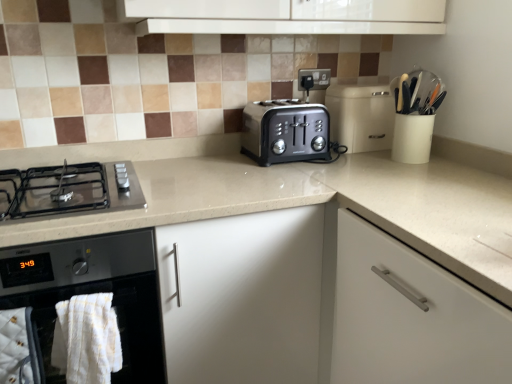
What do you see at coordinates (308, 202) in the screenshot? I see `beige glossy countertop at center` at bounding box center [308, 202].

What do you see at coordinates (285, 132) in the screenshot? This screenshot has height=384, width=512. I see `satin black toaster at center` at bounding box center [285, 132].

The image size is (512, 384). Describe the element at coordinates (361, 116) in the screenshot. I see `beige plastic bread bin at center` at that location.

Locate an element on the screen. This screenshot has height=384, width=512. black matte gas stove at lower left is located at coordinates (74, 190).

Identify the location of white fluffy bath towel at lower left. pyautogui.click(x=87, y=339).

Where is `black glass oven at lower left`? black glass oven at lower left is located at coordinates (92, 293).

From the picture: Which object is positioned more to the left, black glass oven at lower left or beige glossy countertop at center?

Positioned to the left is black glass oven at lower left.

Considering their positions, is black glass oven at lower left located in front of or behind beige glossy countertop at center?

In the image, black glass oven at lower left appears in front of beige glossy countertop at center.

Who is shorter, black glass oven at lower left or beige glossy countertop at center?

Standing shorter between the two is black glass oven at lower left.

Could you tell me if black glass oven at lower left is facing beige glossy countertop at center?

Yes, black glass oven at lower left is facing beige glossy countertop at center.

From a real-world perspective, who is located higher, beige glossy countertop at center or black glass oven at lower left?

black glass oven at lower left.

Between beige glossy countertop at center and black glass oven at lower left, which one is positioned behind?

Positioned behind is beige glossy countertop at center.

Can you confirm if beige glossy countertop at center is taller than black glass oven at lower left?

Yes, beige glossy countertop at center is taller than black glass oven at lower left.

Is beige glossy countertop at center positioned with its back to black glass oven at lower left?

Yes, beige glossy countertop at center is positioned with its back facing black glass oven at lower left.

Does point (251, 130) appear closer or farther from the camera than point (68, 352)?

Point (251, 130) is farther from the camera than point (68, 352).

Does satin black toaster at center lie behind white fluffy bath towel at lower left?

Yes, it is behind white fluffy bath towel at lower left.

Find the location of a particular element. bath towel to the left of satin black toaster at center is located at coordinates (87, 339).

Is satin black toaster at center in contact with white fluffy bath towel at lower left?

No.

From a real-world perspective, between beige plastic bread bin at center and black matte gas stove at lower left, who is vertically higher?

From a 3D spatial view, beige plastic bread bin at center is above.

Where is `gas stove on the left of beige plastic bread bin at center`? The width and height of the screenshot is (512, 384). gas stove on the left of beige plastic bread bin at center is located at coordinates (74, 190).

Can you confirm if beige plastic bread bin at center is wider than black matte gas stove at lower left?

No, beige plastic bread bin at center is not wider than black matte gas stove at lower left.

Between black matte gas stove at lower left and black glass oven at lower left, which one appears on the left side from the viewer's perspective?

black glass oven at lower left.

From a real-world perspective, is black matte gas stove at lower left positioned above or below black glass oven at lower left?

black matte gas stove at lower left is situated higher than black glass oven at lower left in the real world.

Which is behind, black matte gas stove at lower left or black glass oven at lower left?

A: black matte gas stove at lower left is further away from the camera.

Locate an element on the screen. The image size is (512, 384). gas stove lying behind the black glass oven at lower left is located at coordinates (74, 190).

Is beige plastic bread bin at center not close to white fluffy bath towel at lower left?

beige plastic bread bin at center is positioned a significant distance from white fluffy bath towel at lower left.

How many degrees apart are the facing directions of beige plastic bread bin at center and white fluffy bath towel at lower left?

beige plastic bread bin at center and white fluffy bath towel at lower left are facing 3.6 degrees away from each other.

Considering the relative positions of beige plastic bread bin at center and white fluffy bath towel at lower left in the image provided, is beige plastic bread bin at center to the left of white fluffy bath towel at lower left from the viewer's perspective?

Incorrect, beige plastic bread bin at center is not on the left side of white fluffy bath towel at lower left.

Does point (371, 123) come closer to viewer compared to point (82, 350)?

No, (371, 123) is further to viewer.

Is satin black toaster at center to the right of black glass oven at lower left from the viewer's perspective?

Indeed, satin black toaster at center is positioned on the right side of black glass oven at lower left.

From a real-world perspective, is satin black toaster at center positioned over black glass oven at lower left based on gravity?

Indeed, from a real-world perspective, satin black toaster at center stands above black glass oven at lower left.

Would you say satin black toaster at center is inside or outside black glass oven at lower left?

satin black toaster at center is not enclosed by black glass oven at lower left.

Does satin black toaster at center have a lesser height compared to black glass oven at lower left?

Yes.

Where is `countertop on the right of the black glass oven at lower left`? The width and height of the screenshot is (512, 384). countertop on the right of the black glass oven at lower left is located at coordinates (x=308, y=202).

Identify the location of home appliance that appears on the left of beige glossy countertop at center. point(92,293).

Based on their spatial positions, is black matte gas stove at lower left or white fluffy bath towel at lower left further from satin black toaster at center?

white fluffy bath towel at lower left is further to satin black toaster at center.

Based on their spatial positions, is white fluffy bath towel at lower left or beige plastic bread bin at center further from beige glossy countertop at center?

Among the two, white fluffy bath towel at lower left is located further to beige glossy countertop at center.

Estimate the real-world distances between objects in this image. Which object is further from satin black toaster at center, black glass oven at lower left or beige glossy countertop at center?

black glass oven at lower left lies further to satin black toaster at center than the other object.

When comparing their distances from beige plastic bread bin at center, does white fluffy bath towel at lower left or beige glossy countertop at center seem closer?

Among the two, beige glossy countertop at center is located nearer to beige plastic bread bin at center.

When comparing their distances from black matte gas stove at lower left, does black glass oven at lower left or beige plastic bread bin at center seem further?

Based on the image, beige plastic bread bin at center appears to be further to black matte gas stove at lower left.

Which object lies further to the anchor point black matte gas stove at lower left, beige glossy countertop at center or black glass oven at lower left?

Among the two, beige glossy countertop at center is located further to black matte gas stove at lower left.

Looking at the image, which one is located closer to black glass oven at lower left, beige plastic bread bin at center or satin black toaster at center?

satin black toaster at center is closer to black glass oven at lower left.

From the picture: Based on their spatial positions, is black glass oven at lower left or beige plastic bread bin at center further from white fluffy bath towel at lower left?

beige plastic bread bin at center lies further to white fluffy bath towel at lower left than the other object.

Find the location of `countertop located between black glass oven at lower left and satin black toaster at center in the left-right direction`. countertop located between black glass oven at lower left and satin black toaster at center in the left-right direction is located at coordinates (308, 202).

At what (x,y) coordinates should I click in order to perform the action: click on bath towel between black matte gas stove at lower left and beige plastic bread bin at center in the horizontal direction. Please return your answer as a coordinate pair (x, y). The width and height of the screenshot is (512, 384). Looking at the image, I should click on (x=87, y=339).

Image resolution: width=512 pixels, height=384 pixels. What are the coordinates of `countertop located between black glass oven at lower left and beige plastic bread bin at center in the left-right direction` in the screenshot? It's located at (308, 202).

I want to click on countertop between white fluffy bath towel at lower left and beige plastic bread bin at center, so click(x=308, y=202).